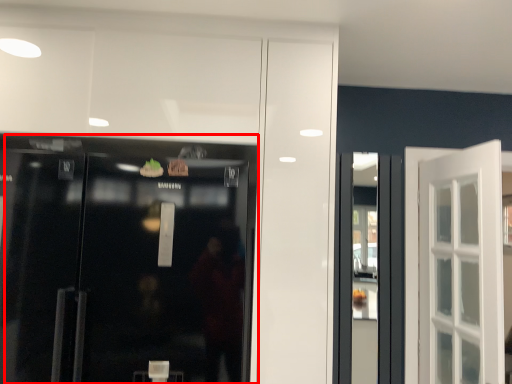
Question: From the image's perspective, where is door (annotated by the red box) located relative to shop window?

Choices:
 (A) below
 (B) above

Answer: (B)